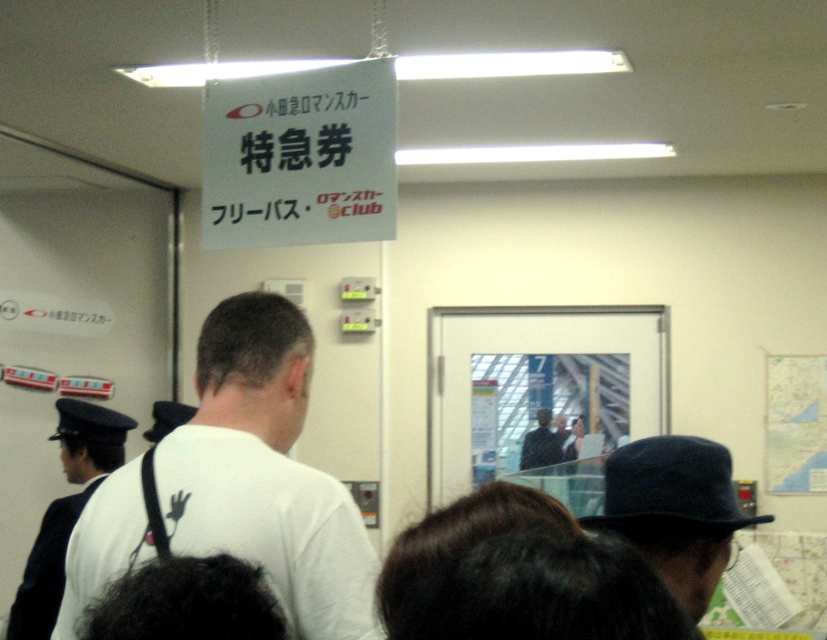
You are a photographer trying to capture a clear shot of the dark blue felt hat at center and the white uniform at left. Since you want both subjects to be equally prominent in your photo, which object should you zoom in on more?

The dark blue felt hat at center has a smaller size compared to the white uniform at left. To make both equally prominent, you should zoom in more on the dark blue felt hat at center to enlarge its appearance in the photo.